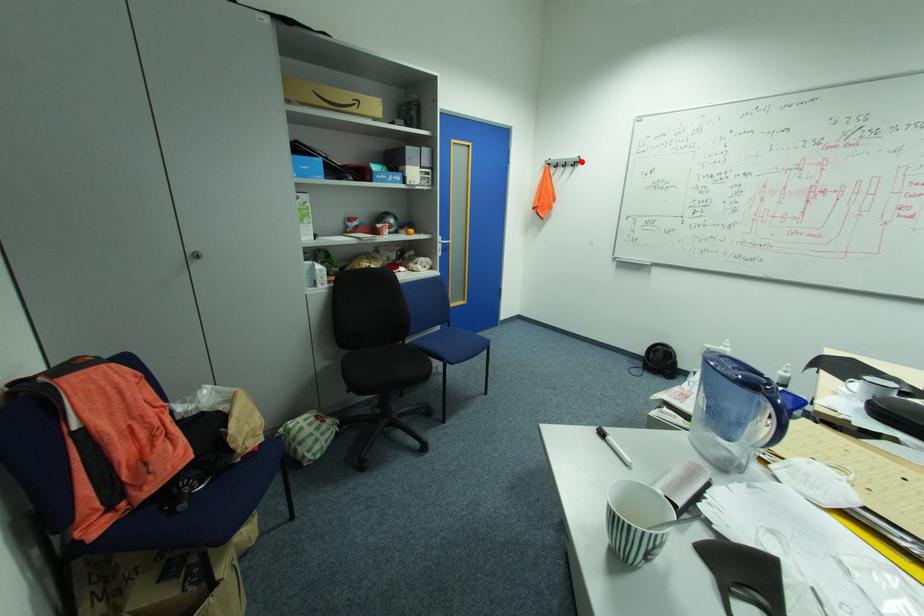
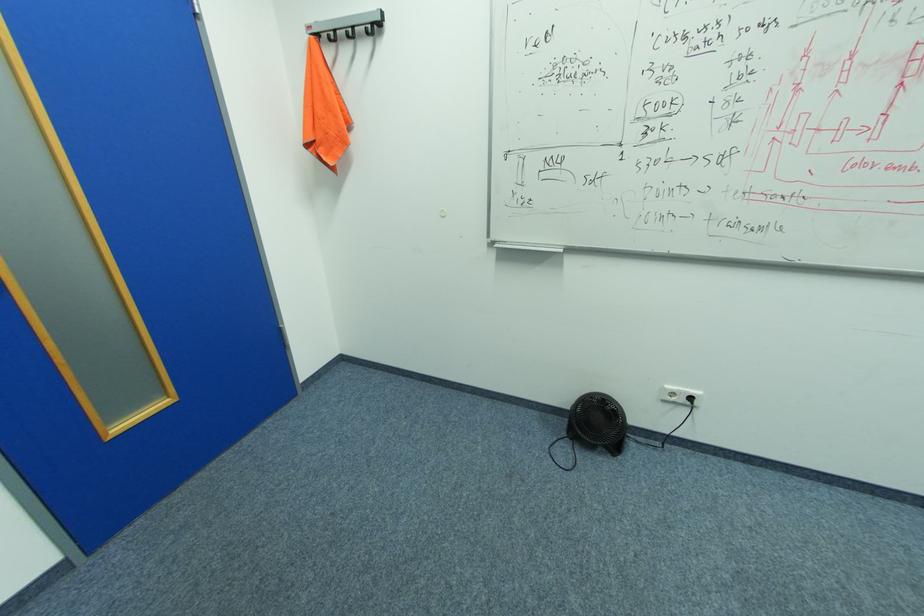
In the second image, find the point that corresponds to the highlighted location in the first image.

(379, 23)